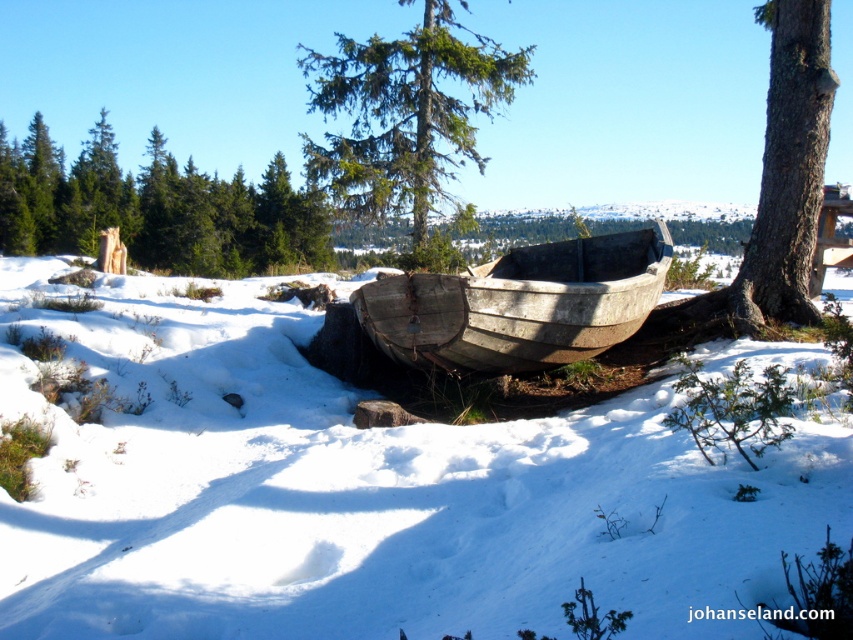
You are standing at the center of the image and want to walk towards the brown wood tree at left. In which direction should you move?

You should move towards the left since the brown wood tree at left is located at the left side of the image.

You are standing in the winter landscape and want to walk towards the brown wood tree at left. Which direction should you move relative to the white powdery snow at center?

Since the white powdery snow at center is in front of the brown wood tree at left, you should move towards the brown wood tree at left by walking behind the white powdery snow at center.